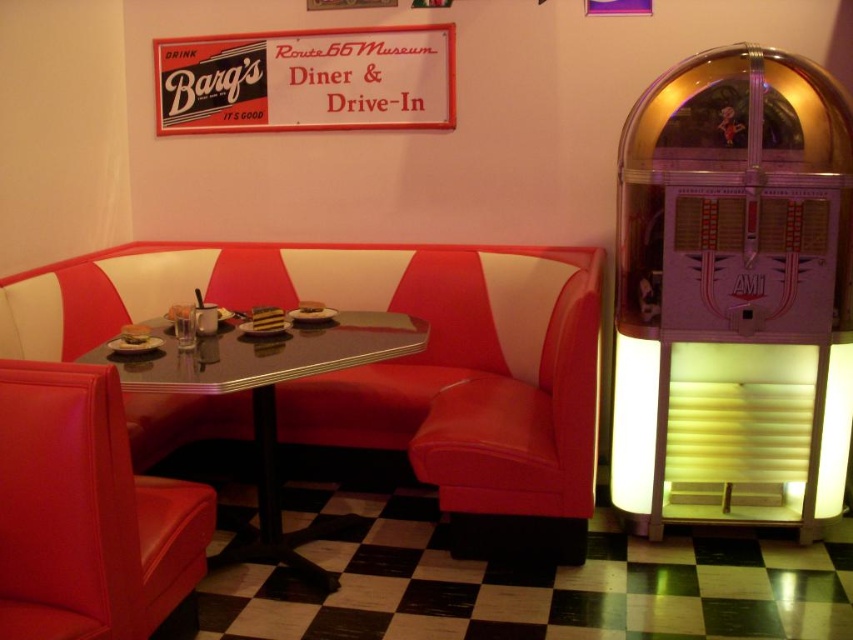
You are standing in the diner and want to read the white cardboard sign at upper center. Where should you look?

You should look at point (x=306, y=81) to read the white cardboard sign at upper center.

You are a delivery person who needs to place a small package between the white cardboard sign at upper center and the shiny black table at center. The package requires 5 feet of space. Can you fit it there?

The distance between the white cardboard sign at upper center and the shiny black table at center is 5.11 feet, which is more than enough to accommodate the 5 feet required for the package. Yes, the package can be placed there.

You are standing in the diner and want to take a photo of the point at coordinates (131, 612). The camera you have can only focus on objects within 2 meters. Will the point be in focus?

The point at coordinates (131, 612) is 1.89 meters away from the camera, so it will be within the focus range of 2 meters and should be in focus.